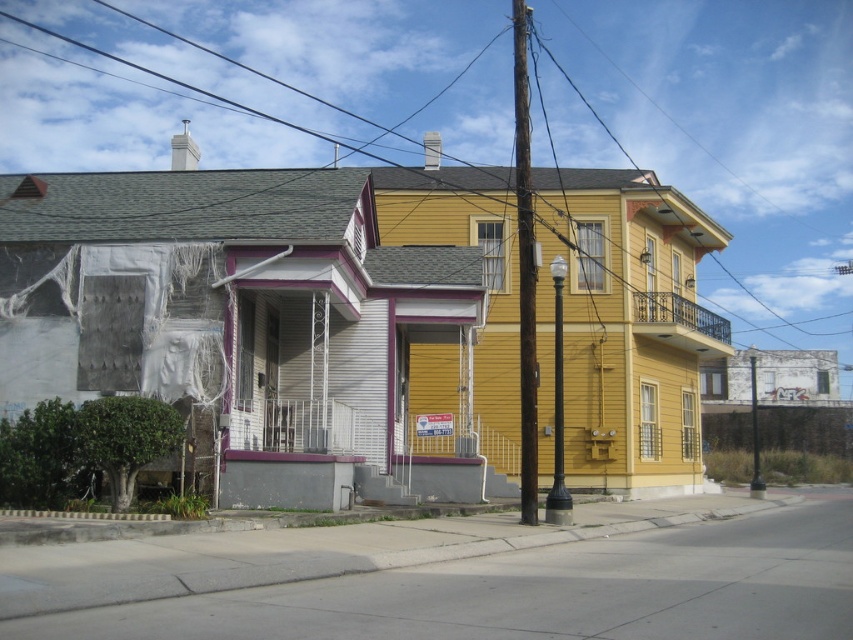
Question: Is black wire at upper center thinner than brown wooden utility pole at center?

Choices:
 (A) no
 (B) yes

Answer: (A)

Question: Which point is closer to the camera?

Choices:
 (A) (778, 84)
 (B) (518, 19)

Answer: (B)

Question: Which of the following is the farthest from the observer?

Choices:
 (A) (151, 161)
 (B) (537, 365)

Answer: (A)

Question: Can you confirm if black wire at upper center is positioned to the right of brown wooden utility pole at center?

Choices:
 (A) no
 (B) yes

Answer: (A)

Question: From the image, what is the correct spatial relationship of black wire at upper center in relation to brown wooden utility pole at center?

Choices:
 (A) right
 (B) left

Answer: (B)